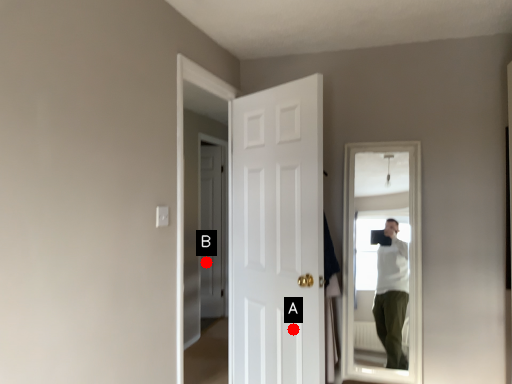
Question: Two points are circled on the image, labeled by A and B beside each circle. Which point is farther to the camera?

Choices:
 (A) A is further
 (B) B is further

Answer: (B)